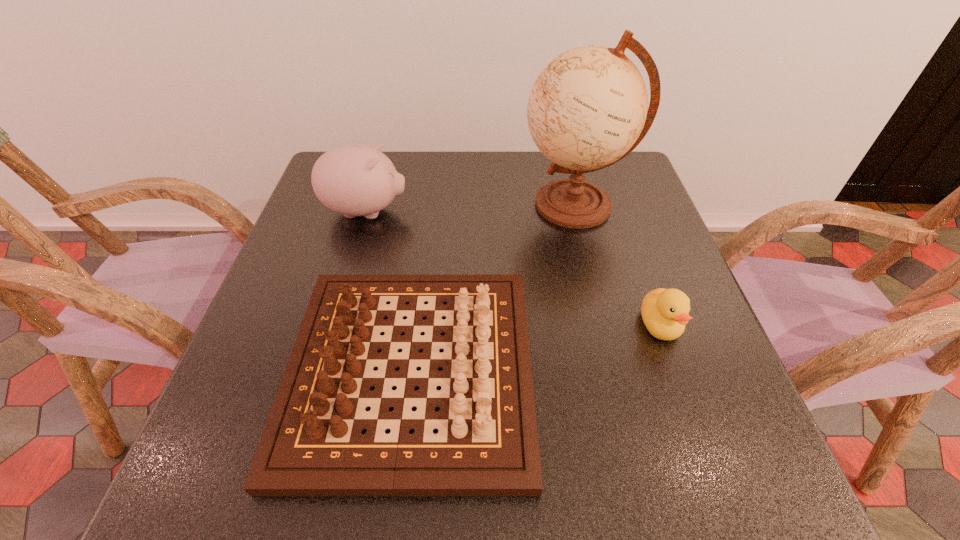
In the image, there is a desktop. Identify the location of vacant area at the far edge. (490, 172).

The image size is (960, 540). In the image, there is a desktop. What are the coordinates of `vacant space at the near edge` in the screenshot? It's located at (536, 497).

In the image, there is a desktop. At what (x,y) coordinates should I click in order to perform the action: click on free region at the left edge. Please return your answer as a coordinate pair (x, y). The height and width of the screenshot is (540, 960). Looking at the image, I should click on (267, 300).

Find the location of `vacant space at the right edge of the desktop`. vacant space at the right edge of the desktop is located at coordinates (636, 231).

The height and width of the screenshot is (540, 960). I want to click on free location at the near right corner of the desktop, so [758, 485].

You are a GUI agent. You are given a task and a screenshot of the screen. Output one action in this format:
    pyautogui.click(x=<x>, y=<y>)
    Task: Click on the unoccupied position between the globe and the piggy bank
    This screenshot has height=540, width=960.
    Given the screenshot: What is the action you would take?
    pyautogui.click(x=470, y=208)

This screenshot has height=540, width=960. In order to click on vacant region between the piggy bank and the duckling in this screenshot , I will do `click(513, 268)`.

In order to click on vacant space in between the duckling and the tallest object in this screenshot , I will do `click(617, 265)`.

At what (x,y) coordinates should I click in order to perform the action: click on unoccupied area between the gameboard and the duckling. Please return your answer as a coordinate pair (x, y). Image resolution: width=960 pixels, height=540 pixels. Looking at the image, I should click on (536, 348).

Where is `free space between the tallest object and the duckling`? free space between the tallest object and the duckling is located at coordinates (617, 265).